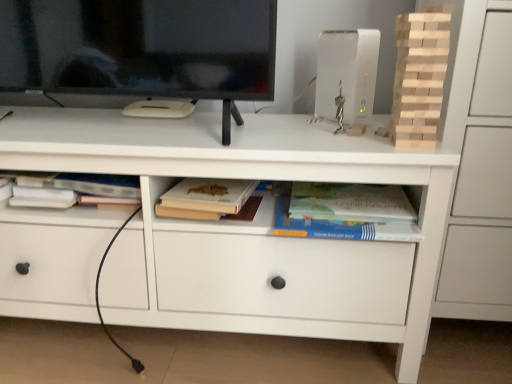
Question: Should I look upward or downward to see matte beige book at center, which ranks as the first paperback book in left-to-right order?

Choices:
 (A) down
 (B) up

Answer: (A)

Question: Is white matte chest of drawers at center oriented away from matte beige book at center, marked as the 2th paperback book in a right-to-left arrangement?

Choices:
 (A) yes
 (B) no

Answer: (A)

Question: Is the surface of white matte chest of drawers at center in direct contact with matte beige book at center, which ranks as the first paperback book in left-to-right order?

Choices:
 (A) yes
 (B) no

Answer: (B)

Question: Is white matte chest of drawers at center smaller than matte beige book at center, which ranks as the first paperback book in left-to-right order?

Choices:
 (A) yes
 (B) no

Answer: (B)

Question: Is white matte chest of drawers at center positioned in front of matte beige book at center, which ranks as the first paperback book in left-to-right order?

Choices:
 (A) yes
 (B) no

Answer: (A)

Question: Considering the relative sizes of white matte chest of drawers at center and matte beige book at center, marked as the 2th paperback book in a right-to-left arrangement, in the image provided, is white matte chest of drawers at center shorter than matte beige book at center, marked as the 2th paperback book in a right-to-left arrangement,?

Choices:
 (A) no
 (B) yes

Answer: (A)

Question: Does white matte chest of drawers at center have a greater height compared to matte beige book at center, marked as the 2th paperback book in a right-to-left arrangement?

Choices:
 (A) no
 (B) yes

Answer: (B)

Question: Is matte beige book at center, which ranks as the first paperback book in left-to-right order, thinner than white plastic router at upper right?

Choices:
 (A) no
 (B) yes

Answer: (A)

Question: Is matte beige book at center, marked as the 2th paperback book in a right-to-left arrangement, positioned with its back to white plastic router at upper right?

Choices:
 (A) yes
 (B) no

Answer: (B)

Question: Considering the relative positions of matte beige book at center, marked as the 2th paperback book in a right-to-left arrangement, and white plastic router at upper right in the image provided, is matte beige book at center, marked as the 2th paperback book in a right-to-left arrangement, to the right of white plastic router at upper right from the viewer's perspective?

Choices:
 (A) no
 (B) yes

Answer: (A)

Question: Does matte beige book at center, which ranks as the first paperback book in left-to-right order, turn towards white plastic router at upper right?

Choices:
 (A) no
 (B) yes

Answer: (A)

Question: Is white plastic router at upper right inside matte beige book at center, marked as the 2th paperback book in a right-to-left arrangement?

Choices:
 (A) yes
 (B) no

Answer: (B)

Question: Considering the relative positions of matte beige book at center, which ranks as the first paperback book in left-to-right order, and white plastic router at upper right in the image provided, is matte beige book at center, which ranks as the first paperback book in left-to-right order, to the left of white plastic router at upper right from the viewer's perspective?

Choices:
 (A) yes
 (B) no

Answer: (A)

Question: From the image's perspective, would you say white plastic router at upper right is shown under hardcover book at center, arranged as the 1th paperback book when viewed from the right?

Choices:
 (A) no
 (B) yes

Answer: (A)